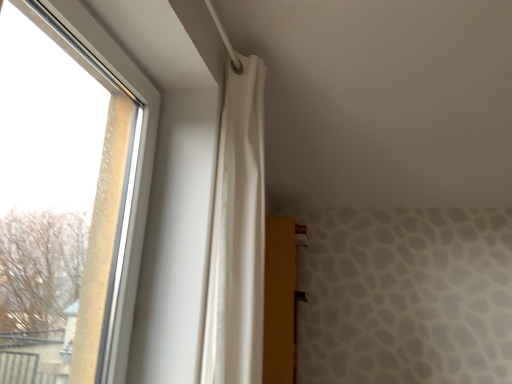
Identify the location of transparent glass window at left. (62, 189).

What do you see at coordinates (62, 189) in the screenshot?
I see `transparent glass window at left` at bounding box center [62, 189].

You are a GUI agent. You are given a task and a screenshot of the screen. Output one action in this format:
    pyautogui.click(x=<x>, y=<y>)
    Task: Click on the transparent glass window at left
    The width and height of the screenshot is (512, 384).
    Given the screenshot: What is the action you would take?
    pyautogui.click(x=62, y=189)